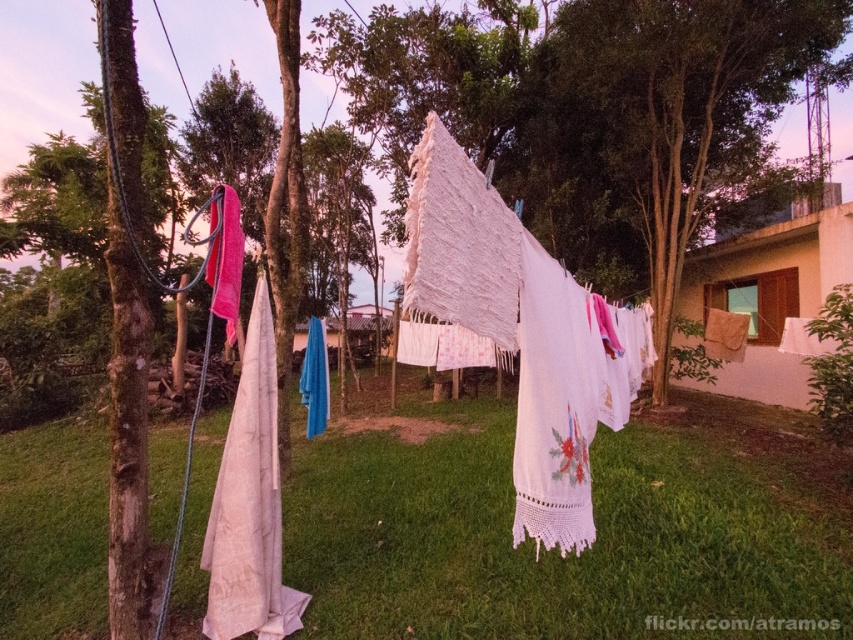
Between green grass at center and white crochet cloth at center, which one appears on the left side from the viewer's perspective?

Positioned to the left is green grass at center.

Between point (48, 602) and point (584, 310), which one is positioned in front?

Point (584, 310) is more forward.

Between point (294, 579) and point (521, 502), which one is positioned in front?

Point (521, 502) is in front.

Find the location of a particular element. The image size is (853, 640). green grass at center is located at coordinates (555, 552).

Does white cotton cloth at center have a lesser width compared to blue fabric at center?

No, white cotton cloth at center is not thinner than blue fabric at center.

Does white cotton cloth at center appear on the right side of blue fabric at center?

Yes, white cotton cloth at center is to the right of blue fabric at center.

Image resolution: width=853 pixels, height=640 pixels. I want to click on white cotton cloth at center, so click(x=459, y=243).

Does white crochet towel at center appear under white lace towel at left?

No, white crochet towel at center is not below white lace towel at left.

Find the location of a particular element. white crochet towel at center is located at coordinates (521, 332).

Who is more distant from viewer, (509, 284) or (276, 401)?

The point (276, 401) is more distant.

You are a GUI agent. You are given a task and a screenshot of the screen. Output one action in this format:
    pyautogui.click(x=<x>, y=<y>)
    Task: Click on the white crochet towel at center
    
    Given the screenshot: What is the action you would take?
    pyautogui.click(x=521, y=332)